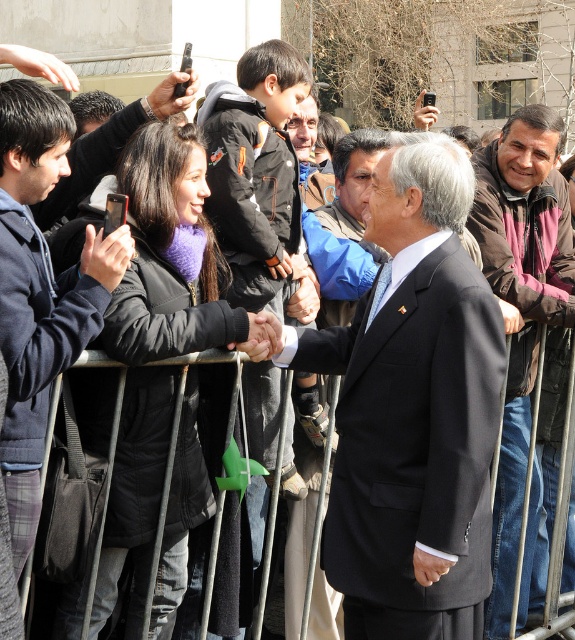
Can you confirm if brown leather jacket at center is positioned above black plastic phone at upper center?

No, brown leather jacket at center is not above black plastic phone at upper center.

Image resolution: width=575 pixels, height=640 pixels. What are the coordinates of `brown leather jacket at center` in the screenshot? It's located at (522, 301).

You are a GUI agent. You are given a task and a screenshot of the screen. Output one action in this format:
    pyautogui.click(x=<x>, y=<y>)
    Task: Click on the brown leather jacket at center
    The image size is (575, 640).
    Given the screenshot: What is the action you would take?
    pyautogui.click(x=522, y=301)

From the picture: Is black matte suit at center positioned at the back of black plastic phone at upper center?

No.

Based on the photo, is black matte suit at center wider than black plastic phone at upper center?

Yes.

Where is `black matte suit at center`? Image resolution: width=575 pixels, height=640 pixels. black matte suit at center is located at coordinates (412, 410).

Does navy blue jacket at center appear over metallic phone at upper center?

No, navy blue jacket at center is not above metallic phone at upper center.

Between navy blue jacket at center and metallic phone at upper center, which one is positioned lower?

Positioned lower is navy blue jacket at center.

Locate an element on the screen. navy blue jacket at center is located at coordinates (40, 291).

The height and width of the screenshot is (640, 575). What are the coordinates of `navy blue jacket at center` in the screenshot? It's located at (40, 291).